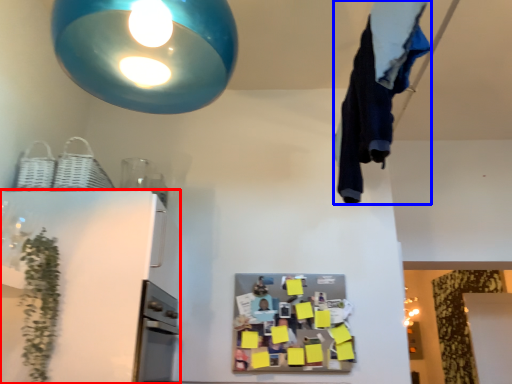
Question: Which object appears farthest to the camera in this image, appliance (highlighted by a red box) or laundry (highlighted by a blue box)?

Choices:
 (A) appliance
 (B) laundry

Answer: (A)